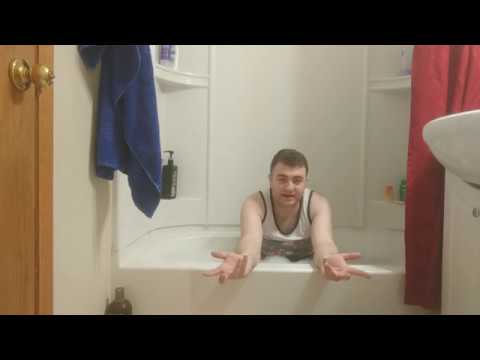
This screenshot has height=360, width=480. I want to click on tub, so click(204, 246).